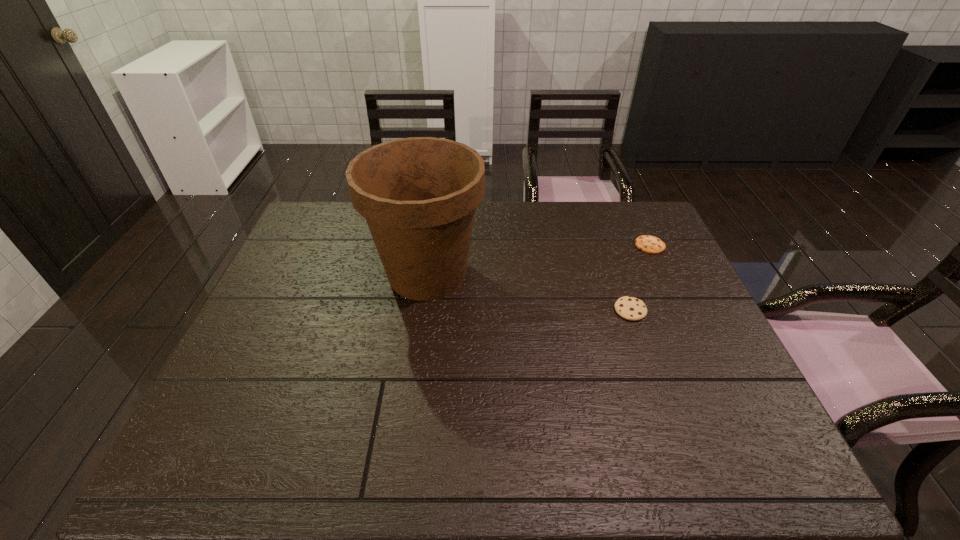
Identify the location of vacant area between the left cookie and the rightmost object. The width and height of the screenshot is (960, 540). (640, 278).

I want to click on unoccupied position between the tallest object and the left cookie, so click(x=529, y=292).

This screenshot has height=540, width=960. What are the coordinates of `free point between the right cookie and the leftmost object` in the screenshot? It's located at (539, 260).

Locate an element on the screen. This screenshot has height=540, width=960. free space between the tallest object and the right cookie is located at coordinates (539, 260).

Find the location of a particular element. Image resolution: width=960 pixels, height=540 pixels. free space between the tallest object and the taller cookie is located at coordinates (529, 292).

The image size is (960, 540). What are the coordinates of `vacant area that lies between the second object from right to left and the shorter cookie` in the screenshot? It's located at (640, 278).

At what (x,y) coordinates should I click in order to perform the action: click on free space between the second shortest object and the flowerpot. Please return your answer as a coordinate pair (x, y). This screenshot has width=960, height=540. Looking at the image, I should click on (529, 292).

Identify which object is the second closest to the leftmost object. Please provide its 2D coordinates. Your answer should be formatted as a tuple, i.e. [(x, y)], where the tuple contains the x and y coordinates of a point satisfying the conditions above.

[(649, 244)]

Locate which object ranks second in proximity to the tallest object. Please provide its 2D coordinates. Your answer should be formatted as a tuple, i.e. [(x, y)], where the tuple contains the x and y coordinates of a point satisfying the conditions above.

[(649, 244)]

Locate an element on the screen. This screenshot has height=540, width=960. free spot that satisfies the following two spatial constraints: 1. on the front side of the leftmost object; 2. on the right side of the taller cookie is located at coordinates pyautogui.click(x=422, y=310).